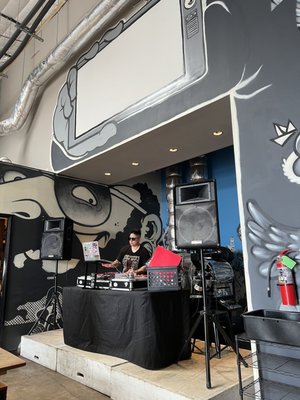
The width and height of the screenshot is (300, 400). What are the coordinates of `stage` in the screenshot? It's located at (167, 396), (92, 367), (41, 351).